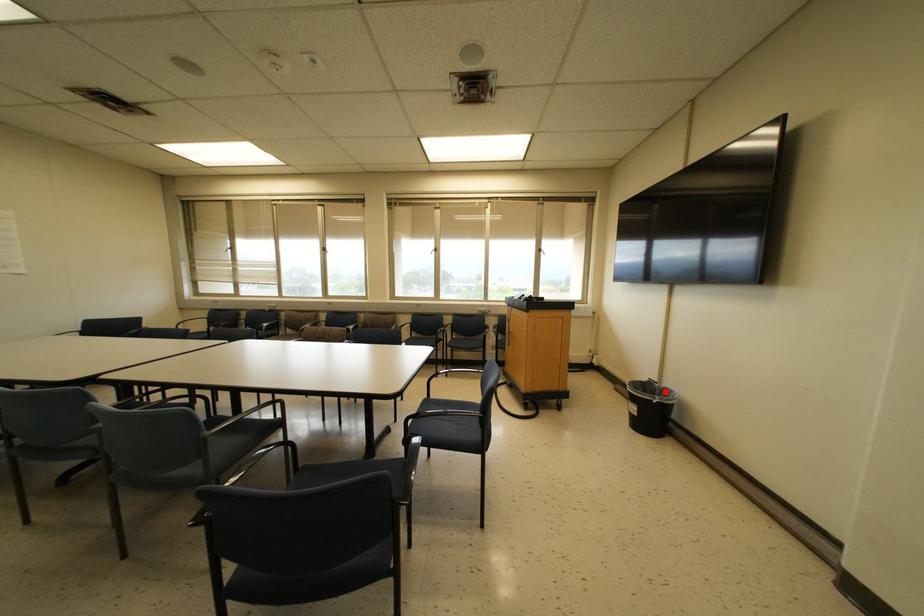
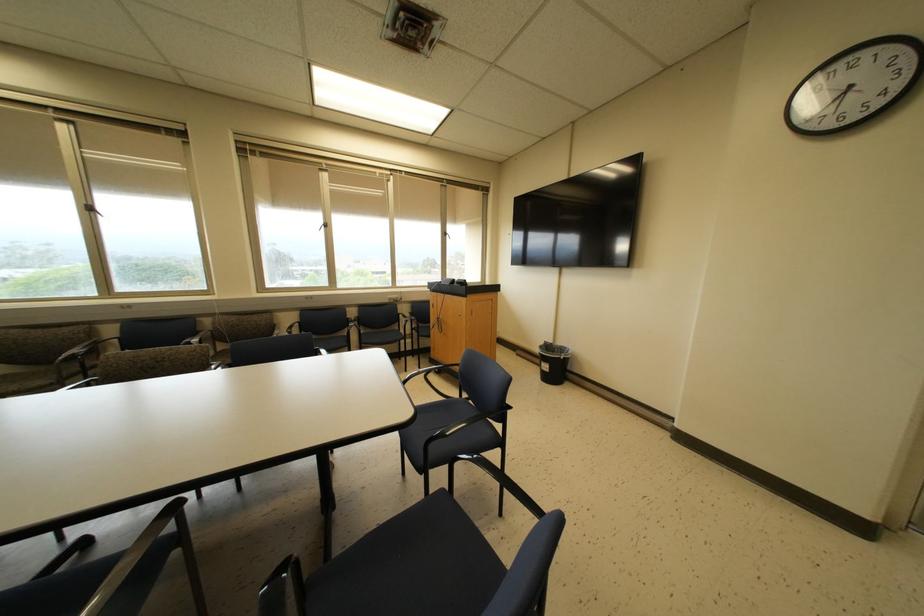
Question: I am providing you with two images of the same scene from different viewpoints. In image1, a red point is highlighted. Considering the same 3D point in image2, which of the following is correct?

Choices:
 (A) It is closer
 (B) It is farther

Answer: (A)